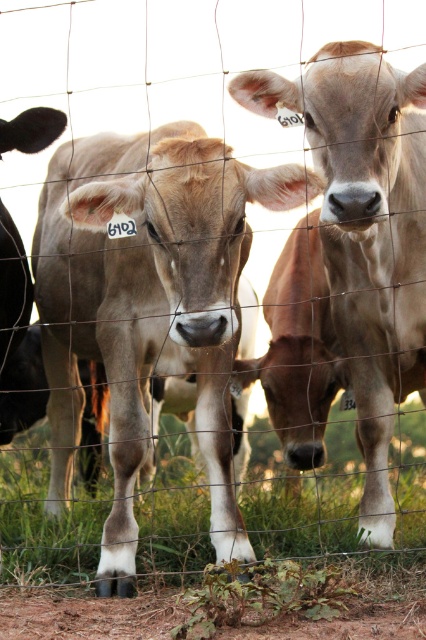
Who is more distant from viewer, (299,99) or (287,499)?

Positioned behind is point (287,499).

Does smooth tan bull at center have a smaller size compared to green grass at lower center?

Yes.

At what (x,y) coordinates should I click in order to perform the action: click on smooth tan bull at center. Please return your answer as a coordinate pair (x, y). The height and width of the screenshot is (640, 426). Looking at the image, I should click on (365, 232).

At what (x,y) coordinates should I click in order to perform the action: click on smooth tan bull at center. Please return your answer as a coordinate pair (x, y). The width and height of the screenshot is (426, 640). Looking at the image, I should click on (365, 232).